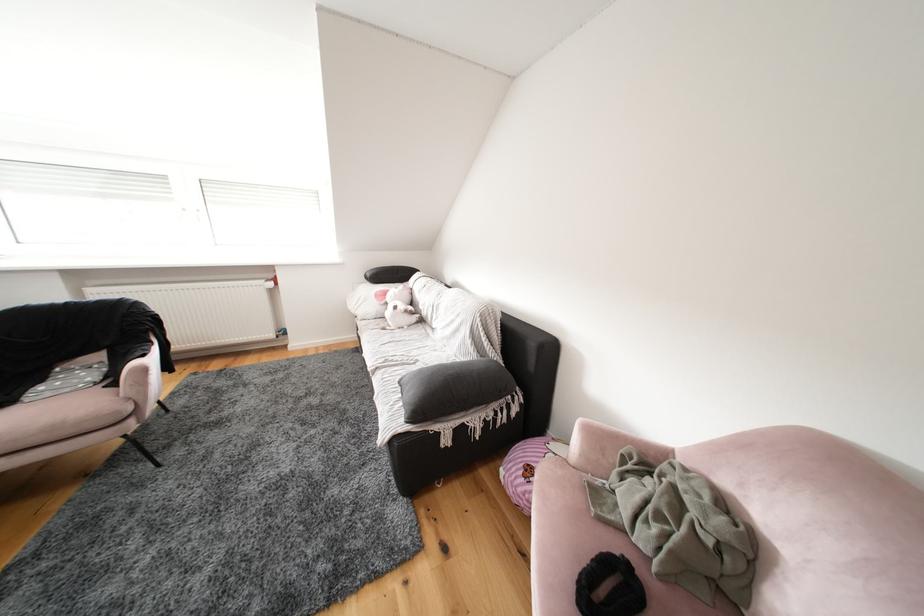
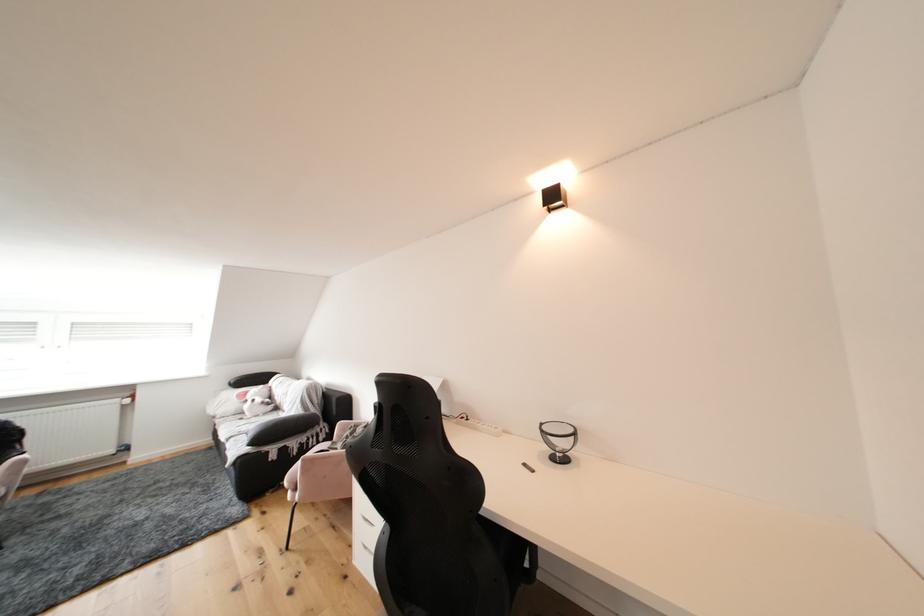
The point at [439,334] is marked in the first image. Where is the corresponding point in the second image?

(290, 416)